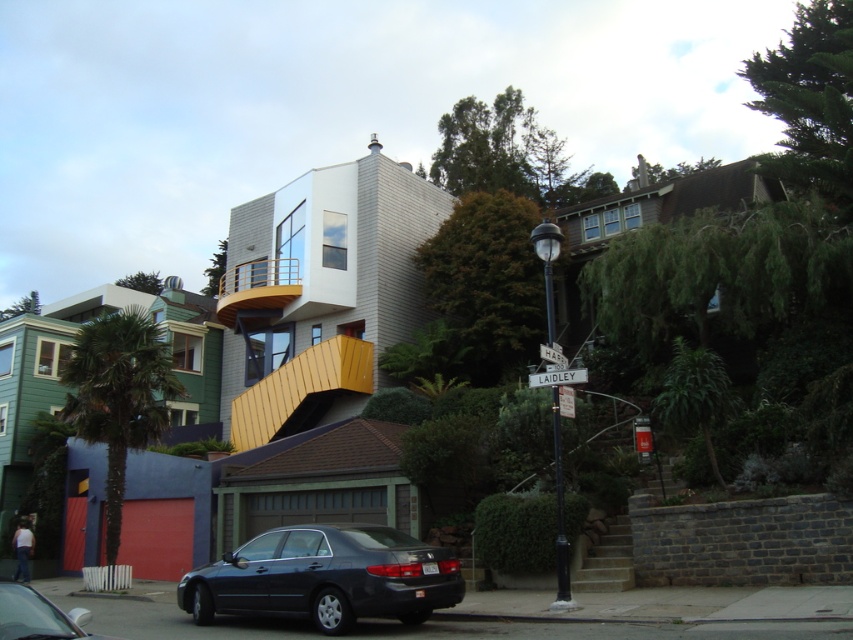
Is shiny black sedan at lower left positioned in front of white plastic street sign at center?

That is True.

Which is more to the left, shiny black sedan at lower left or white plastic street sign at center?

From the viewer's perspective, shiny black sedan at lower left appears more on the left side.

Which is in front, point (48, 618) or point (558, 372)?

Point (48, 618) is in front.

The width and height of the screenshot is (853, 640). Find the location of `shiny black sedan at lower left`. shiny black sedan at lower left is located at coordinates (38, 616).

Can you confirm if matte black sedan at lower center is positioned to the right of white plastic street sign at center?

No, matte black sedan at lower center is not to the right of white plastic street sign at center.

Between matte black sedan at lower center and white plastic street sign at center, which one has less height?

With less height is white plastic street sign at center.

Who is more distant from viewer, (279, 609) or (550, 371)?

A: The point (550, 371) is more distant.

At what (x,y) coordinates should I click in order to perform the action: click on matte black sedan at lower center. Please return your answer as a coordinate pair (x, y). This screenshot has width=853, height=640. Looking at the image, I should click on (326, 577).

Looking at this image, who is lower down, matte black sedan at lower center or black metal street sign at center?

Positioned lower is matte black sedan at lower center.

What do you see at coordinates (326, 577) in the screenshot?
I see `matte black sedan at lower center` at bounding box center [326, 577].

This screenshot has width=853, height=640. Identify the location of matte black sedan at lower center. 326,577.